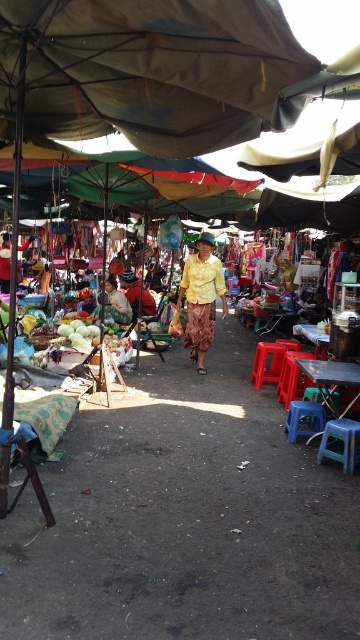
Question: Is yellow plastic stool at lower right thinner than red plastic stool at center?

Choices:
 (A) no
 (B) yes

Answer: (B)

Question: Which point is farther from the camera taking this photo?

Choices:
 (A) (290, 404)
 (B) (216, 276)
 (C) (78, 109)

Answer: (B)

Question: Which object is the closest to the blue plastic stool at lower right?

Choices:
 (A) yellow printed fabric at center
 (B) yellow plastic stool at lower right
 (C) red plastic stool at center

Answer: (B)

Question: Which point is farther from the camera taking this photo?

Choices:
 (A) (316, 404)
 (B) (249, 120)

Answer: (A)

Question: Is blue plastic stool at lower right thinner than red plastic stool at center?

Choices:
 (A) no
 (B) yes

Answer: (B)

Question: Is yellow printed fabric at center above blue plastic stool at lower right?

Choices:
 (A) no
 (B) yes

Answer: (B)